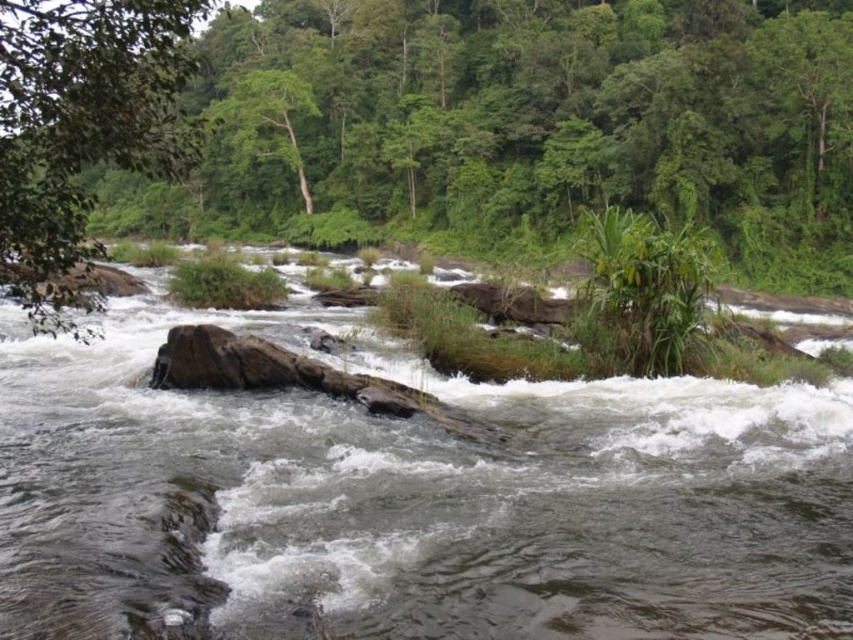
You are a hiker standing at the edge of the river. You see the brown rock at center and the green leafy tree at upper center. Which object is closer to you?

The brown rock at center is closer to the viewer than the green leafy tree at upper center.

You are a hiker trying to cross the river. You see a brown rock at center and a green leafy tree at upper center. Which object is smaller in size?

The brown rock at center has a smaller size compared to the green leafy tree at upper center.

You are standing on the riverbank and want to cross to the other side. You see a brown rock at center and a green leafy tree at left. Which object is closer to you as you look towards the river?

The brown rock at center is closer to you because it is in front of the green leafy tree at left, meaning it is positioned nearer to your viewpoint on the riverbank.